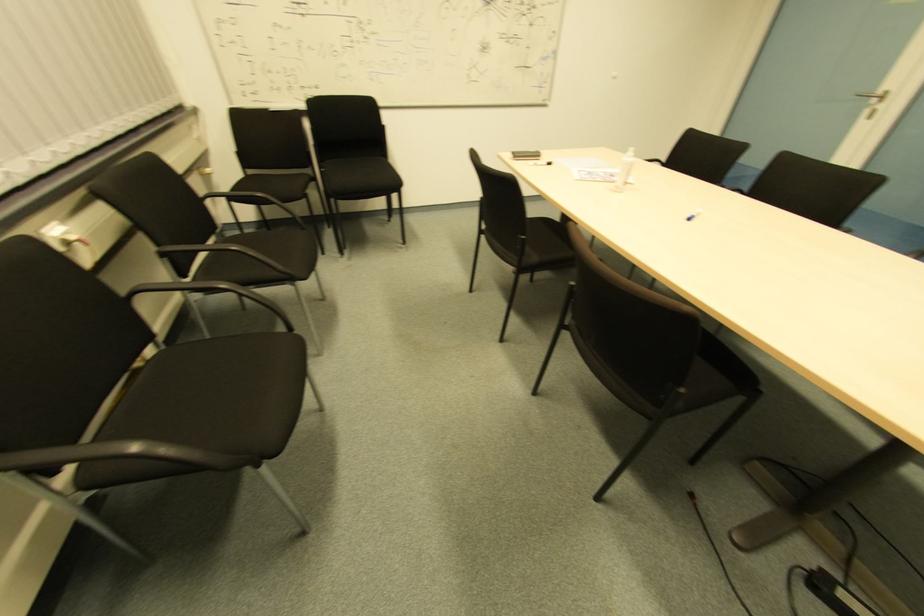
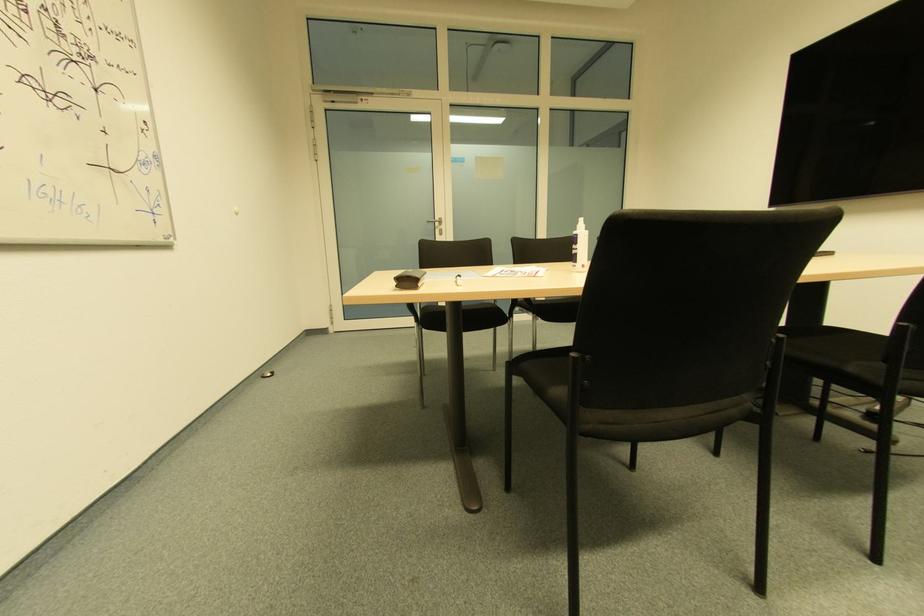
The point at (881, 108) is marked in the first image. Where is the corresponding point in the second image?

(440, 230)